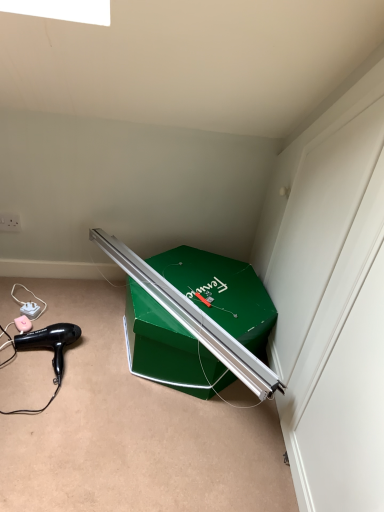
Question: Is green cardboard box at center positioned behind black plastic hair dryer at lower left?

Choices:
 (A) no
 (B) yes

Answer: (A)

Question: Can black plastic hair dryer at lower left be found inside green cardboard box at center?

Choices:
 (A) no
 (B) yes

Answer: (A)

Question: Can you see green cardboard box at center touching black plastic hair dryer at lower left?

Choices:
 (A) no
 (B) yes

Answer: (A)

Question: Can you confirm if green cardboard box at center is positioned to the left of black plastic hair dryer at lower left?

Choices:
 (A) no
 (B) yes

Answer: (A)

Question: Considering the relative sizes of green cardboard box at center and black plastic hair dryer at lower left in the image provided, is green cardboard box at center smaller than black plastic hair dryer at lower left?

Choices:
 (A) no
 (B) yes

Answer: (A)

Question: From a real-world perspective, is green cardboard box at center over black plastic hair dryer at lower left?

Choices:
 (A) no
 (B) yes

Answer: (B)

Question: Can green cardboard box at center be found inside black plastic hair dryer at lower left?

Choices:
 (A) yes
 (B) no

Answer: (B)

Question: From a real-world perspective, is black plastic hair dryer at lower left beneath green cardboard box at center?

Choices:
 (A) yes
 (B) no

Answer: (A)

Question: Is black plastic hair dryer at lower left to the left of green cardboard box at center from the viewer's perspective?

Choices:
 (A) yes
 (B) no

Answer: (A)

Question: Is black plastic hair dryer at lower left further to the viewer compared to green cardboard box at center?

Choices:
 (A) yes
 (B) no

Answer: (A)

Question: Can you confirm if black plastic hair dryer at lower left is thinner than green cardboard box at center?

Choices:
 (A) yes
 (B) no

Answer: (A)

Question: Is the surface of black plastic hair dryer at lower left in direct contact with green cardboard box at center?

Choices:
 (A) no
 (B) yes

Answer: (A)

Question: Is point (61, 366) closer or farther from the camera than point (269, 330)?

Choices:
 (A) farther
 (B) closer

Answer: (B)